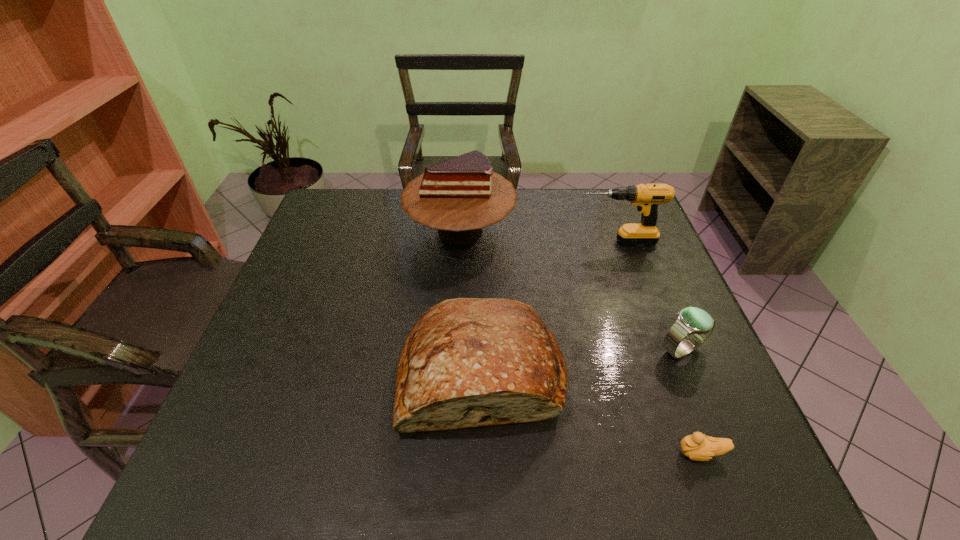
At what (x,y) coordinates should I click in order to perform the action: click on cake. Please return your answer as a coordinate pair (x, y). Looking at the image, I should click on (460, 196).

The height and width of the screenshot is (540, 960). I want to click on drill, so click(647, 197).

At what (x,y) coordinates should I click in order to perform the action: click on bread. Please return your answer as a coordinate pair (x, y). This screenshot has width=960, height=540. Looking at the image, I should click on (467, 362).

This screenshot has width=960, height=540. In order to click on the second shortest object in this screenshot , I will do `click(697, 323)`.

The width and height of the screenshot is (960, 540). In order to click on the nearest object in this screenshot , I will do `click(697, 447)`.

Locate an element on the screen. the shortest object is located at coordinates (697, 447).

Locate an element on the screen. blank space located on the left of the cake is located at coordinates (375, 231).

Find the location of `vacant space located at the tip of the drill`. vacant space located at the tip of the drill is located at coordinates coord(554,241).

Find the location of `vacant region located at the tip of the drill`. vacant region located at the tip of the drill is located at coordinates (524, 241).

Locate an element on the screen. The width and height of the screenshot is (960, 540). free region located 0.180m at the tip of the drill is located at coordinates (514, 241).